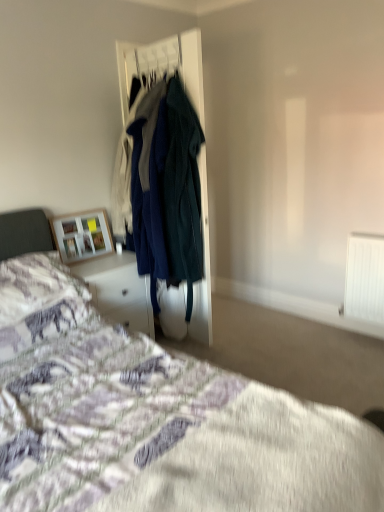
Question: Is white glossy vanity at lower left at the right side of fluffy white pillow at lower left?

Choices:
 (A) no
 (B) yes

Answer: (B)

Question: Can you see white glossy vanity at lower left touching fluffy white pillow at lower left?

Choices:
 (A) yes
 (B) no

Answer: (B)

Question: Is white glossy vanity at lower left positioned with its back to fluffy white pillow at lower left?

Choices:
 (A) yes
 (B) no

Answer: (B)

Question: Considering the relative sizes of white glossy vanity at lower left and fluffy white pillow at lower left in the image provided, is white glossy vanity at lower left smaller than fluffy white pillow at lower left?

Choices:
 (A) no
 (B) yes

Answer: (A)

Question: Does white glossy vanity at lower left have a lesser height compared to fluffy white pillow at lower left?

Choices:
 (A) yes
 (B) no

Answer: (B)

Question: Is wooden frame at upper left in front of or behind white glossy vanity at lower left in the image?

Choices:
 (A) behind
 (B) front

Answer: (A)

Question: Considering the positions of wooden frame at upper left and white glossy vanity at lower left in the image, is wooden frame at upper left wider or thinner than white glossy vanity at lower left?

Choices:
 (A) thin
 (B) wide

Answer: (A)

Question: Considering the positions of wooden frame at upper left and white glossy vanity at lower left in the image, is wooden frame at upper left bigger or smaller than white glossy vanity at lower left?

Choices:
 (A) big
 (B) small

Answer: (B)

Question: Considering the positions of point (64, 225) and point (104, 289), is point (64, 225) closer or farther from the camera than point (104, 289)?

Choices:
 (A) farther
 (B) closer

Answer: (A)

Question: In terms of size, does wooden frame at upper left appear bigger or smaller than dark green wool coat at center?

Choices:
 (A) big
 (B) small

Answer: (B)

Question: Relative to dark green wool coat at center, is wooden frame at upper left in front or behind?

Choices:
 (A) front
 (B) behind

Answer: (B)

Question: Considering the positions of wooden frame at upper left and dark green wool coat at center in the image, is wooden frame at upper left taller or shorter than dark green wool coat at center?

Choices:
 (A) short
 (B) tall

Answer: (A)

Question: Choose the correct answer: Is wooden frame at upper left inside dark green wool coat at center or outside it?

Choices:
 (A) outside
 (B) inside

Answer: (A)

Question: From their relative heights in the image, would you say velvet teal coat at center is taller or shorter than fluffy white pillow at lower left?

Choices:
 (A) short
 (B) tall

Answer: (B)

Question: From a real-world perspective, relative to fluffy white pillow at lower left, is velvet teal coat at center vertically above or below?

Choices:
 (A) above
 (B) below

Answer: (A)